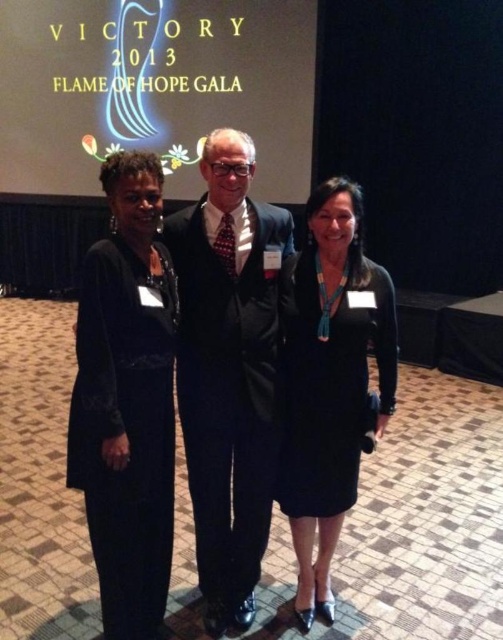
Is black textured suit at center thinner than black satin dress at left?

No, black textured suit at center is not thinner than black satin dress at left.

Between point (252, 236) and point (124, 454), which one is positioned in front?

Point (124, 454) is more forward.

Is point (218, 486) positioned after point (162, 310)?

Yes, it is.

Identify the location of black textured suit at center. The height and width of the screenshot is (640, 503). (228, 371).

Is black satin dress at left below black satin dress at center?

No, black satin dress at left is not below black satin dress at center.

Who is more distant from viewer, (x=160, y=422) or (x=289, y=513)?

Point (x=289, y=513)

Who is more forward, (77, 397) or (308, 355)?

Point (77, 397) is more forward.

Find the location of a particular element. This screenshot has width=503, height=640. black satin dress at left is located at coordinates (126, 401).

In the scene shown: Can you confirm if black textured suit at center is wider than black satin dress at center?

Correct, the width of black textured suit at center exceeds that of black satin dress at center.

Can you confirm if black textured suit at center is positioned to the right of black satin dress at center?

In fact, black textured suit at center is to the left of black satin dress at center.

Between point (186, 356) and point (282, 442), which one is positioned in front?

Point (186, 356) is in front.

Find the location of a particular element. Image resolution: width=503 pixels, height=640 pixels. black textured suit at center is located at coordinates (228, 371).